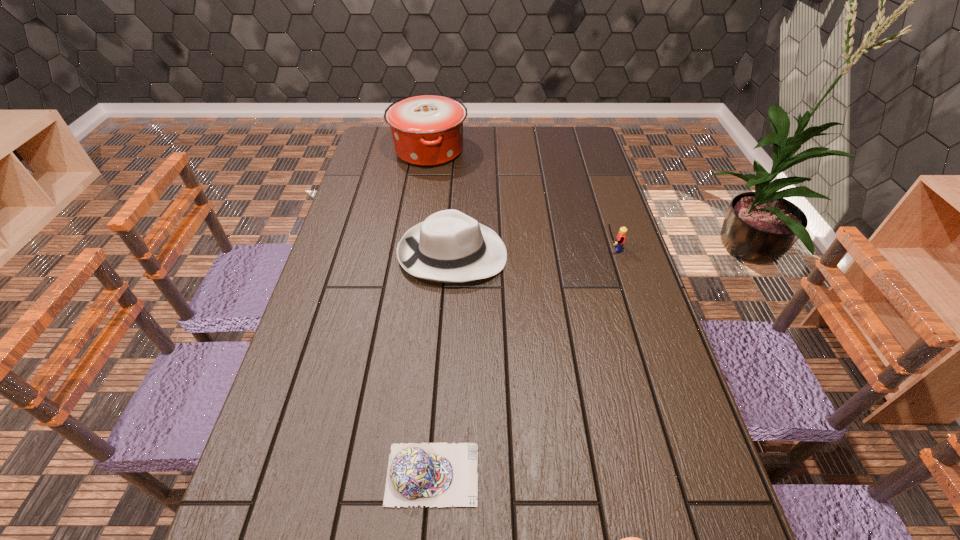
Locate an element on the screen. The image size is (960, 540). free space between the fedora and the Lego is located at coordinates (532, 252).

Locate an element on the screen. The width and height of the screenshot is (960, 540). vacant area between the second nearest object and the rightmost object is located at coordinates (521, 362).

Find the location of `vacant space in between the casserole and the second nearest object`. vacant space in between the casserole and the second nearest object is located at coordinates (431, 312).

Identify the location of vacant space that is in between the Lego and the second nearest object. The image size is (960, 540). (521, 362).

Select which object is the second closest to the second object from right to left. Please provide its 2D coordinates. Your answer should be formatted as a tuple, i.e. [(x, y)], where the tuple contains the x and y coordinates of a point satisfying the conditions above.

[(449, 246)]

The height and width of the screenshot is (540, 960). I want to click on object that is the fourth closest one to the casserole, so click(630, 539).